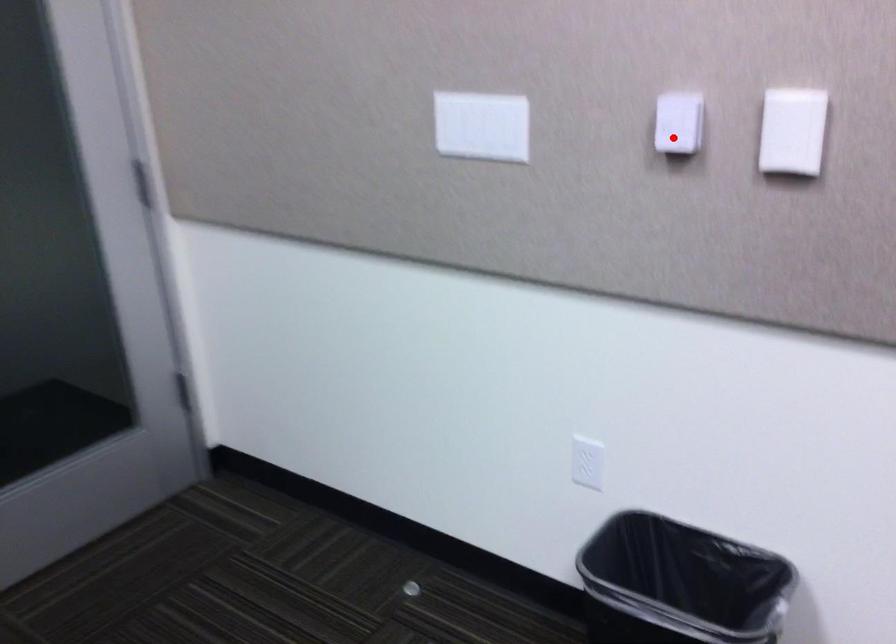
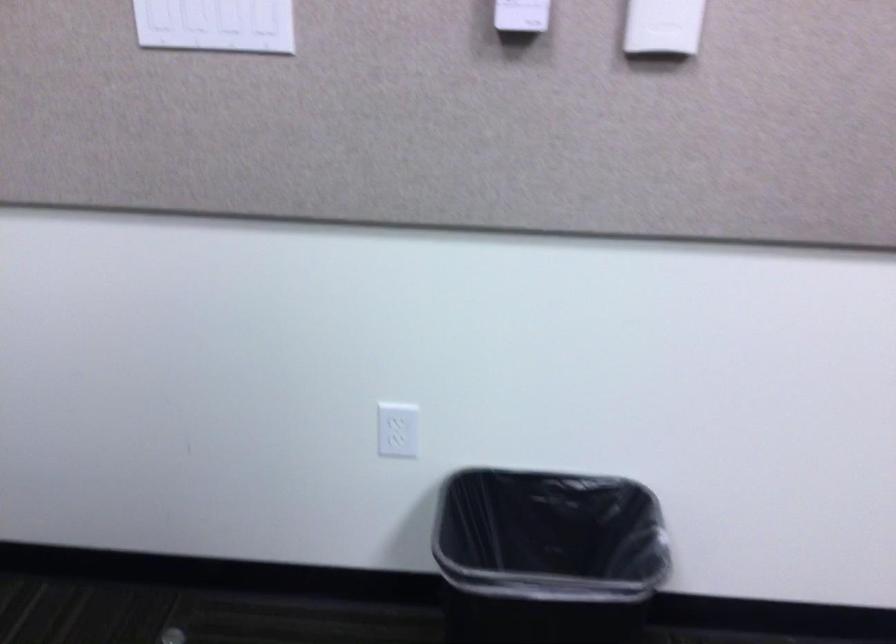
In the second image, find the point that corresponds to the highlighted location in the first image.

(521, 15)